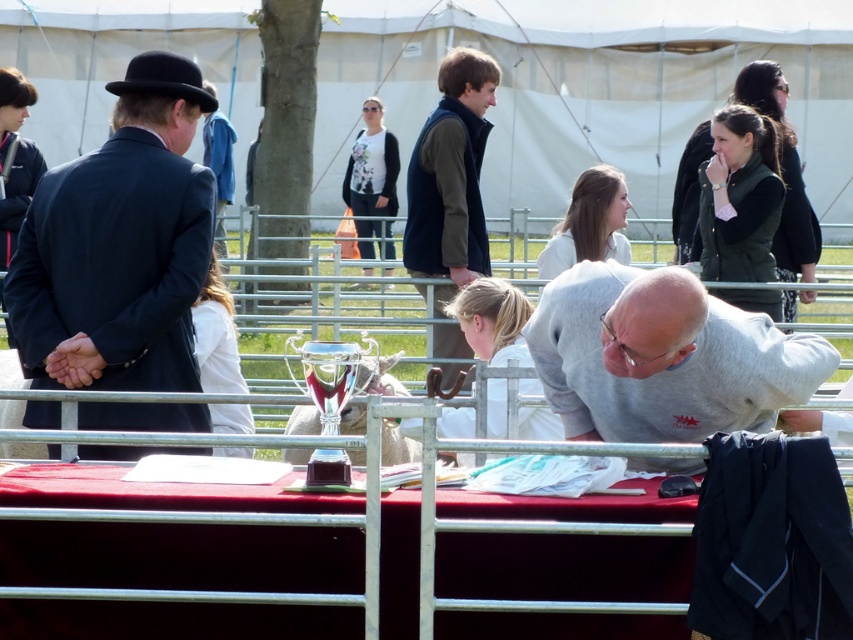
You are standing at the entrance of the tent and want to locate both the white fabric canopy at upper center and the white floral shirt at center. According to the scene description, which object is positioned to the left of the other?

The white fabric canopy at upper center is to the left of the white floral shirt at center.